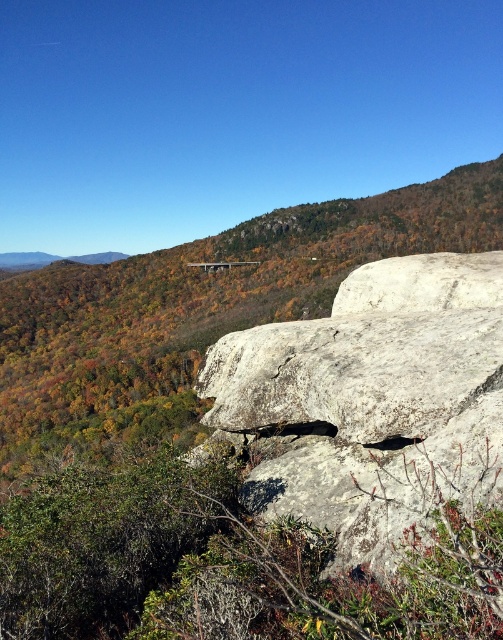
Question: Which point appears farthest from the camera in this image?

Choices:
 (A) (406, 502)
 (B) (301, 321)

Answer: (B)

Question: Considering the relative positions of gray rough rock at center and gray rough boulder at center in the image provided, where is gray rough rock at center located with respect to gray rough boulder at center?

Choices:
 (A) above
 (B) below

Answer: (B)

Question: Does gray rough rock at center appear over gray rough boulder at center?

Choices:
 (A) no
 (B) yes

Answer: (A)

Question: Can you confirm if gray rough rock at center is positioned below gray rough boulder at center?

Choices:
 (A) no
 (B) yes

Answer: (B)